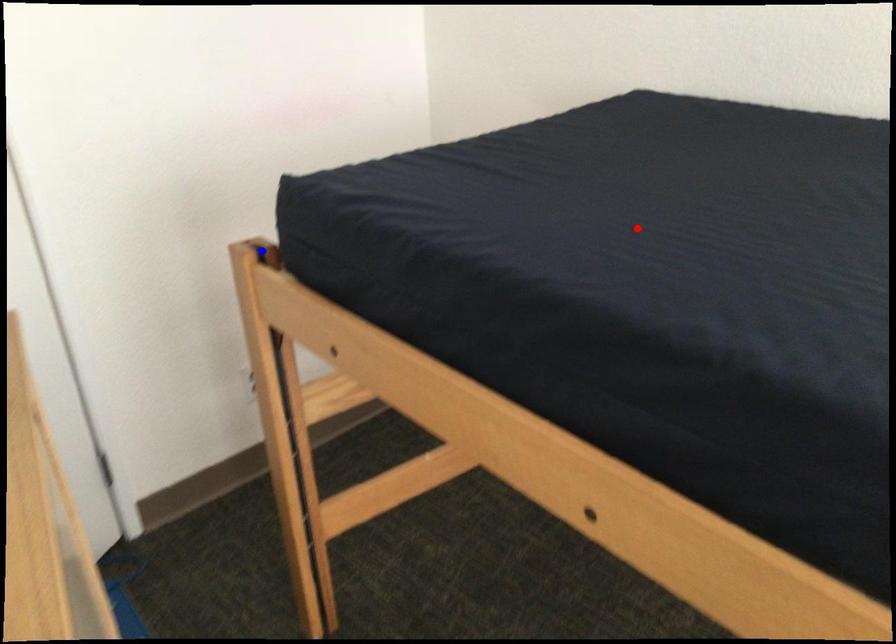
Question: Which of the two points in the image is closer to the camera?

Choices:
 (A) Blue point is closer.
 (B) Red point is closer.

Answer: (B)